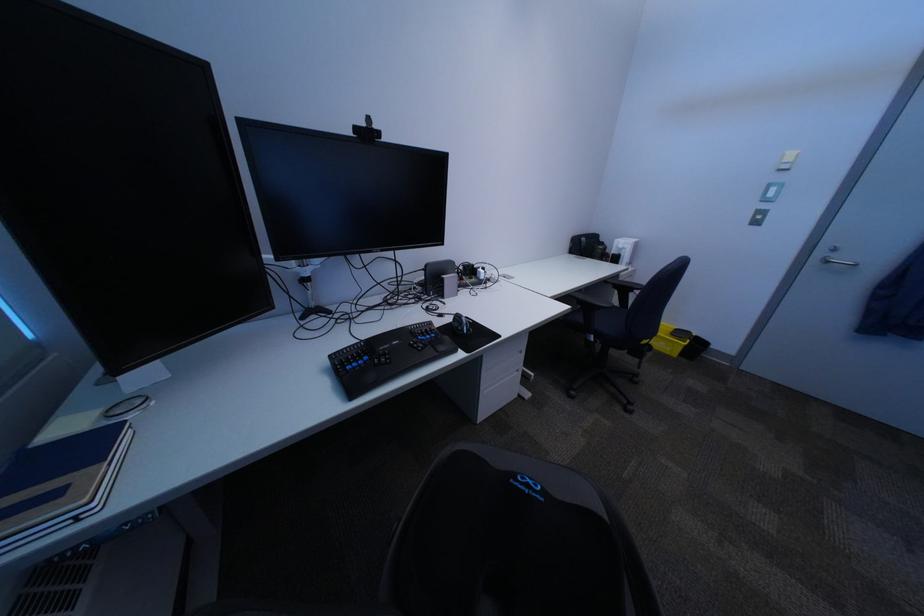
Find the location of a particular element. The image size is (924, 616). gray light switch is located at coordinates (624, 249).